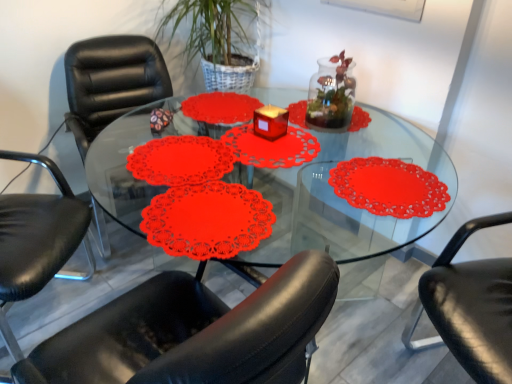
Identify the location of blank space to the left of matte red candle at center. (231, 136).